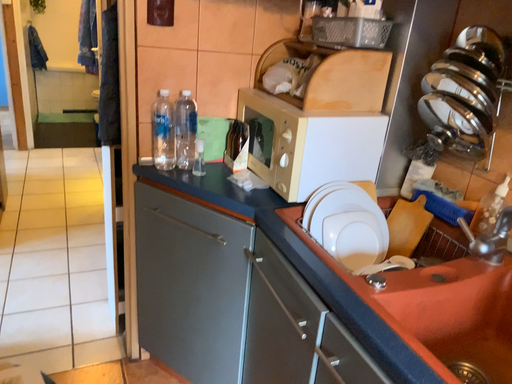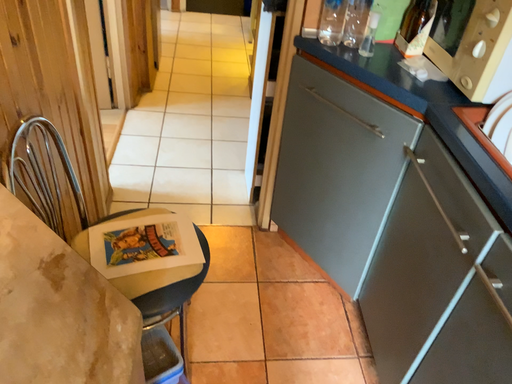
Question: How did the camera likely rotate when shooting the video?

Choices:
 (A) rotated upward
 (B) rotated downward

Answer: (B)